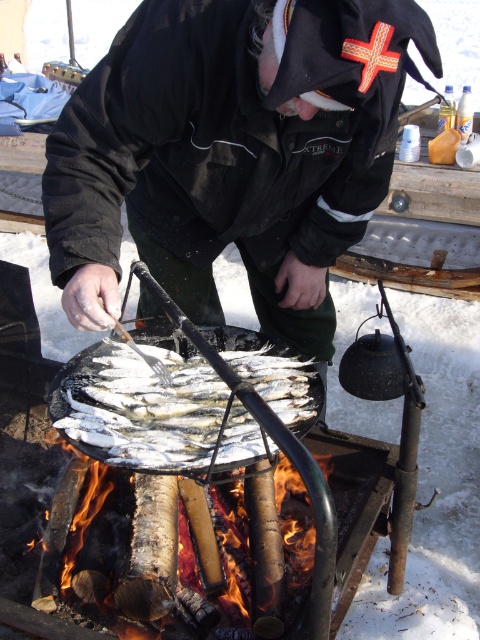
Is silver metallic fish at center to the right of charcoal wood fire at lower left from the viewer's perspective?

No, silver metallic fish at center is not to the right of charcoal wood fire at lower left.

Does silver metallic fish at center lie behind charcoal wood fire at lower left?

Yes, silver metallic fish at center is further from the viewer.

Image resolution: width=480 pixels, height=640 pixels. What do you see at coordinates (147, 410) in the screenshot? I see `silver metallic fish at center` at bounding box center [147, 410].

You are a GUI agent. You are given a task and a screenshot of the screen. Output one action in this format:
    pyautogui.click(x=<x>, y=<y>)
    Task: Click on the silver metallic fish at center
    The width and height of the screenshot is (480, 640).
    Given the screenshot: What is the action you would take?
    pyautogui.click(x=147, y=410)